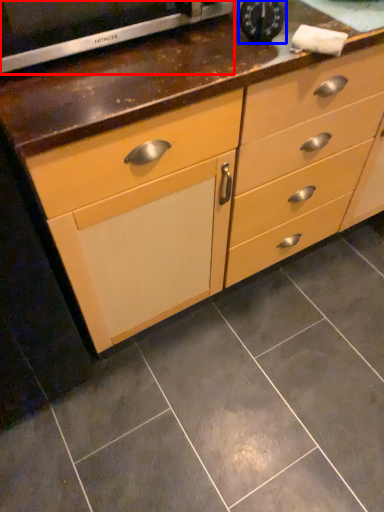
Question: Which object appears closest to the camera in this image, appliance (highlighted by a red box) or appliance (highlighted by a blue box)?

Choices:
 (A) appliance
 (B) appliance

Answer: (A)